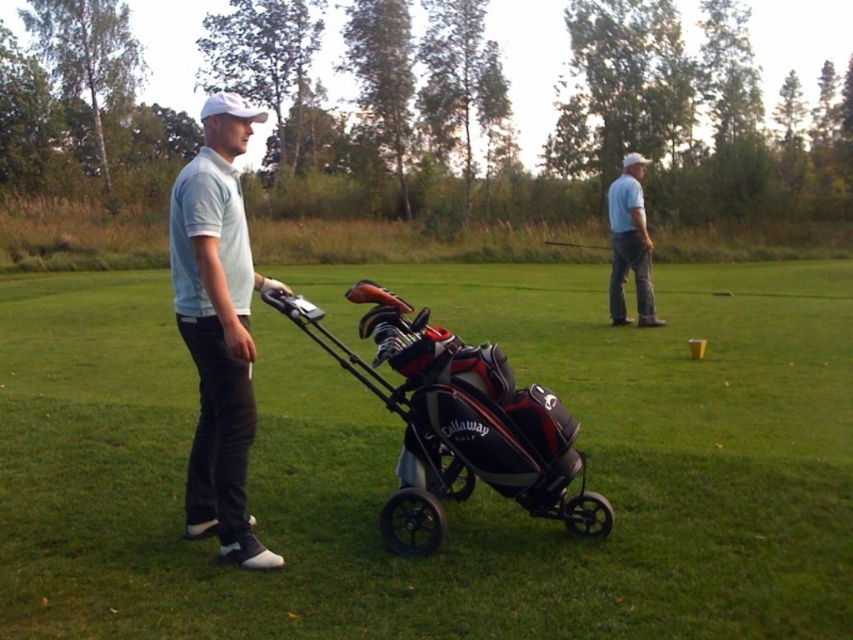
Can you confirm if light blue cotton polo shirt at center is positioned below blue cotton shirt at upper right?

Indeed, light blue cotton polo shirt at center is positioned under blue cotton shirt at upper right.

This screenshot has width=853, height=640. What do you see at coordinates (218, 326) in the screenshot?
I see `light blue cotton polo shirt at center` at bounding box center [218, 326].

Find the location of `light blue cotton polo shirt at center`. light blue cotton polo shirt at center is located at coordinates (218, 326).

Between black textured golf bag at center and blue cotton shirt at upper right, which one is positioned lower?

Positioned lower is black textured golf bag at center.

Does black textured golf bag at center have a lesser width compared to blue cotton shirt at upper right?

Yes, black textured golf bag at center is thinner than blue cotton shirt at upper right.

The height and width of the screenshot is (640, 853). What do you see at coordinates (459, 420) in the screenshot? I see `black textured golf bag at center` at bounding box center [459, 420].

Find the location of a particular element. The image size is (853, 640). black textured golf bag at center is located at coordinates (459, 420).

Between black fabric golf bag at center and black textured golf bag at center, which one appears on the right side from the viewer's perspective?

From the viewer's perspective, black fabric golf bag at center appears more on the right side.

Can you confirm if black fabric golf bag at center is positioned to the left of black textured golf bag at center?

Incorrect, black fabric golf bag at center is not on the left side of black textured golf bag at center.

Locate an element on the screen. The width and height of the screenshot is (853, 640). black fabric golf bag at center is located at coordinates (448, 504).